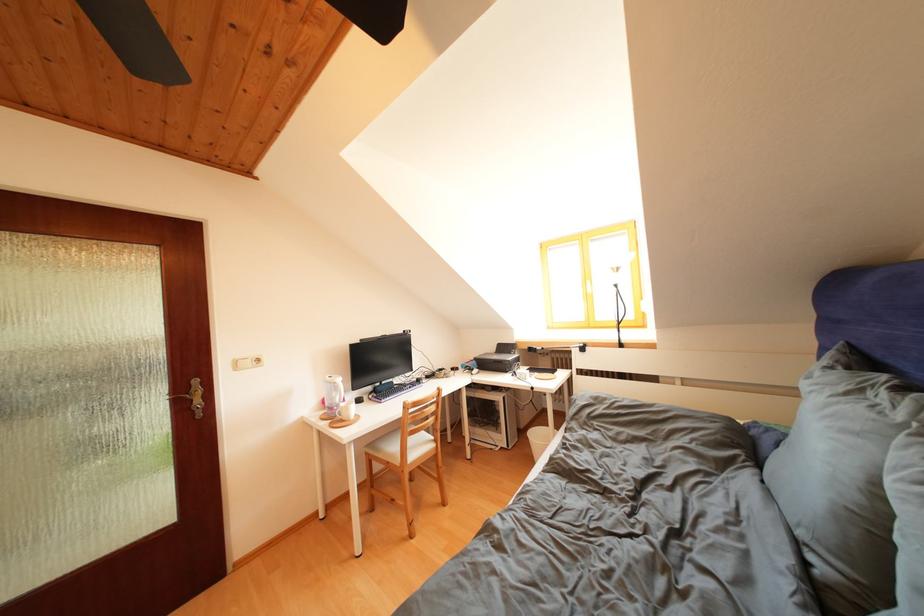
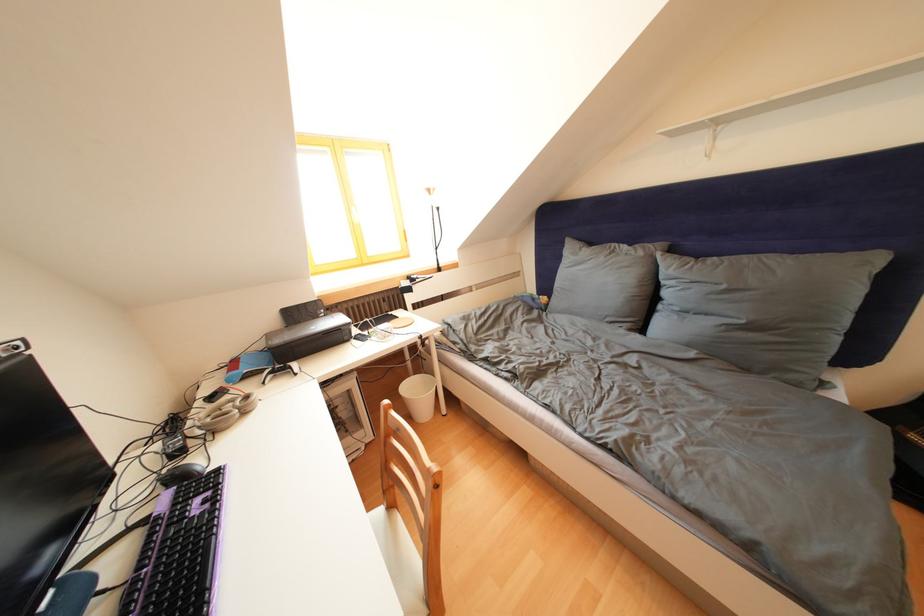
Find the pixel in the second image that matches point 517,358 in the first image.

(323, 322)